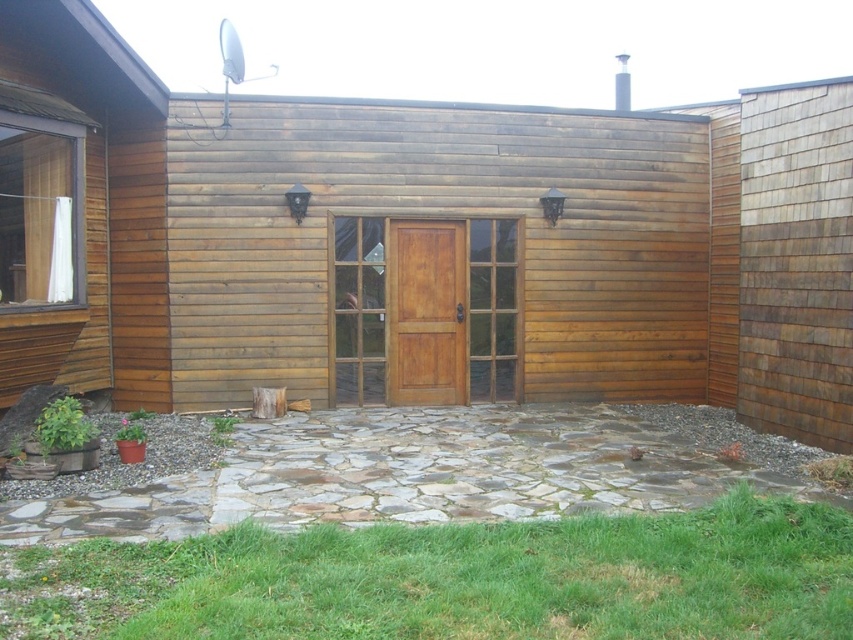
Question: Does green grass at lower center have a lesser width compared to brown wooden screen door at center?

Choices:
 (A) no
 (B) yes

Answer: (A)

Question: Which point is farther to the camera?

Choices:
 (A) green grass at lower center
 (B) brown wooden screen door at center

Answer: (B)

Question: In this image, where is green grass at lower center located relative to brown wooden screen door at center?

Choices:
 (A) left
 (B) right

Answer: (A)

Question: Which of the following is the closest to the observer?

Choices:
 (A) green grass at lower center
 (B) brown wooden screen door at center

Answer: (A)

Question: In this image, where is green grass at lower center located relative to brown wooden screen door at center?

Choices:
 (A) above
 (B) below

Answer: (B)